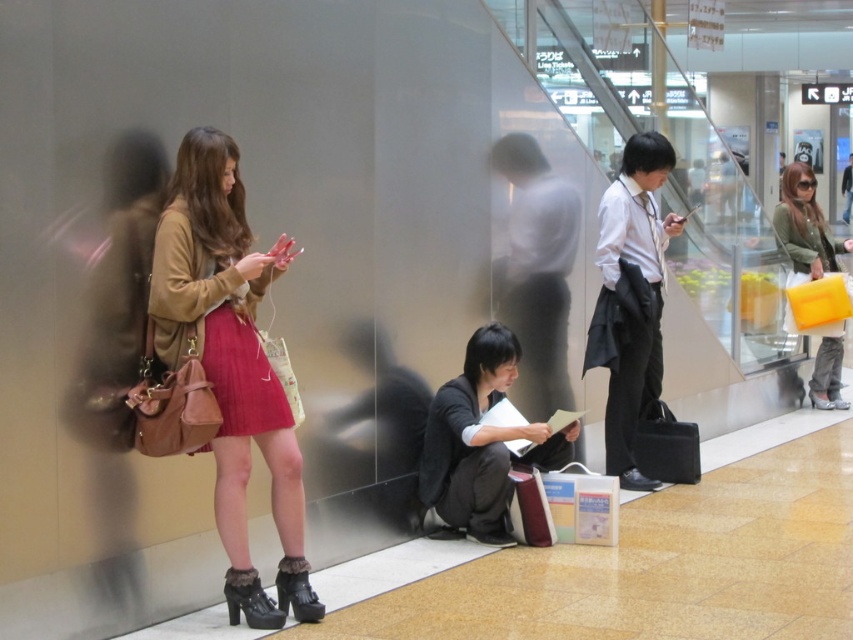
Question: Can you confirm if matte brown purse at left is positioned to the right of matte olive green jacket at right?

Choices:
 (A) no
 (B) yes

Answer: (A)

Question: Does matte brown purse at left lie in front of black matte jacket at lower center?

Choices:
 (A) no
 (B) yes

Answer: (B)

Question: Which of the following is the farthest from the observer?

Choices:
 (A) (234, 410)
 (B) (239, 332)
 (C) (495, 529)

Answer: (C)

Question: Which point appears closest to the camera in this image?

Choices:
 (A) (799, 230)
 (B) (227, 424)
 (C) (204, 237)

Answer: (B)

Question: Which of the following is the farthest from the observer?

Choices:
 (A) velvet pink skirt at left
 (B) black matte jacket at lower center
 (C) matte brown purse at left

Answer: (B)

Question: Is matte brown purse at left in front of matte olive green jacket at right?

Choices:
 (A) yes
 (B) no

Answer: (A)